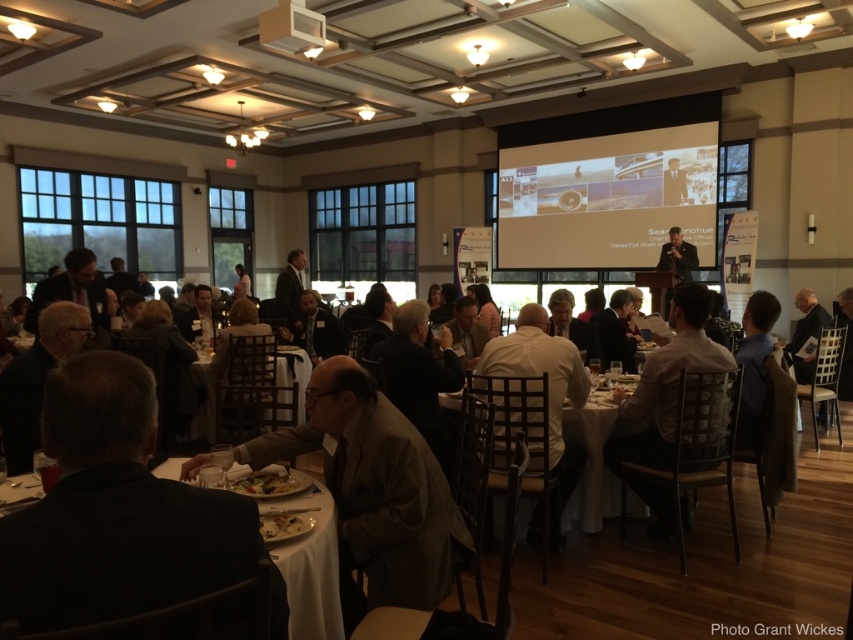
Based on the photo, is white leather chair at center to the right of white cloth at lower left from the viewer's perspective?

Correct, you'll find white leather chair at center to the right of white cloth at lower left.

Can you confirm if white leather chair at center is shorter than white cloth at lower left?

No, white leather chair at center is not shorter than white cloth at lower left.

Is point (515, 376) closer to viewer compared to point (299, 609)?

No, (515, 376) is further to viewer.

Find the location of a particular element. Image resolution: width=853 pixels, height=640 pixels. white leather chair at center is located at coordinates (547, 394).

Can you confirm if wooden chair at center is positioned below golden brown bread at lower center?

No.

Which is more to the left, wooden chair at center or golden brown bread at lower center?

wooden chair at center is more to the left.

Who is more forward, (206, 364) or (253, 481)?

Point (253, 481) is in front.

Where is `wooden chair at center`? The width and height of the screenshot is (853, 640). wooden chair at center is located at coordinates (206, 396).

Measure the distance between light brown leather jacket at center and matte white projector screen at upper center.

light brown leather jacket at center and matte white projector screen at upper center are 28.66 feet apart.

Does light brown leather jacket at center have a greater height compared to matte white projector screen at upper center?

In fact, light brown leather jacket at center may be shorter than matte white projector screen at upper center.

What do you see at coordinates (373, 490) in the screenshot?
I see `light brown leather jacket at center` at bounding box center [373, 490].

Locate an element on the screen. Image resolution: width=853 pixels, height=640 pixels. light brown leather jacket at center is located at coordinates (373, 490).